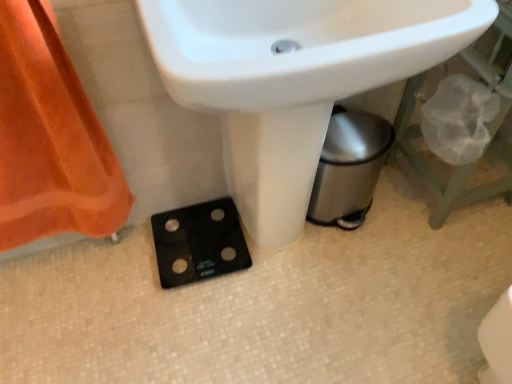
Find the location of `free space in front of orange fabric at left`. free space in front of orange fabric at left is located at coordinates point(73,322).